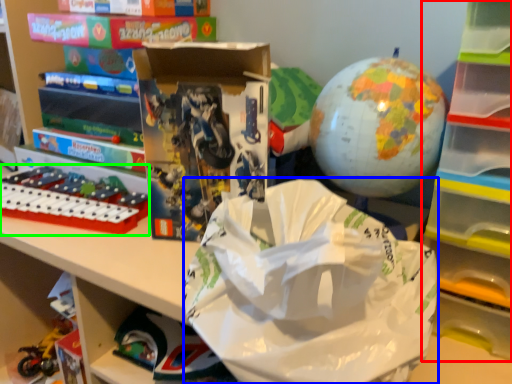
Question: Estimate the real-world distances between objects in this image. Which object is closer to bookshelf (highlighted by a red box), grocery bag (highlighted by a blue box) or toy (highlighted by a green box)?

Choices:
 (A) grocery bag
 (B) toy

Answer: (A)